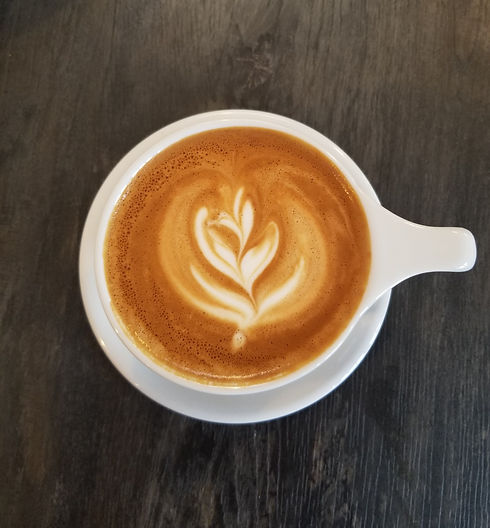
What are the coordinates of `saucer` in the screenshot? It's located at (351, 365).